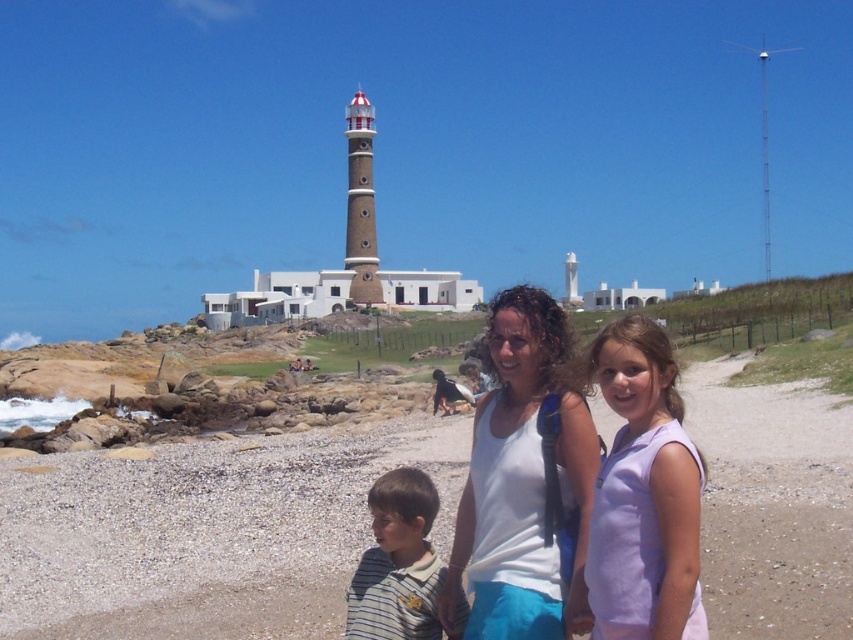
You are standing on the smooth sand beach at lower center and want to reach the purple cotton shirt at center. Which direction should you move to get closer to the shirt?

Since the smooth sand beach at lower center is larger in size than the purple cotton shirt at center, you should move towards the center of the beach to reach the shirt.

You are standing at the lighthouse and want to walk to the smooth sand beach at lower center. Which direction should you head to reach it?

Since the smooth sand beach at lower center is located at coordinate point (204, 532), you should head towards the lower center direction to reach it.